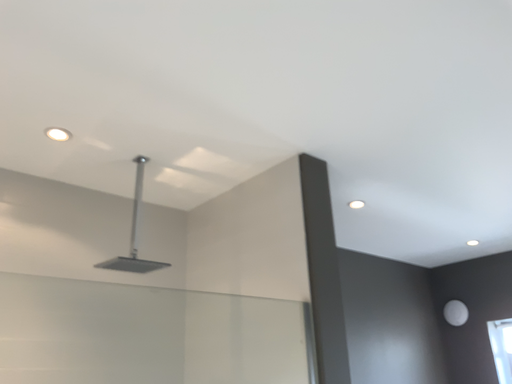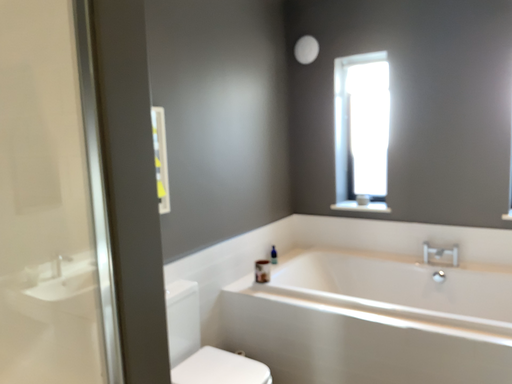
Question: Which way did the camera rotate in the video?

Choices:
 (A) rotated upward
 (B) rotated downward

Answer: (B)